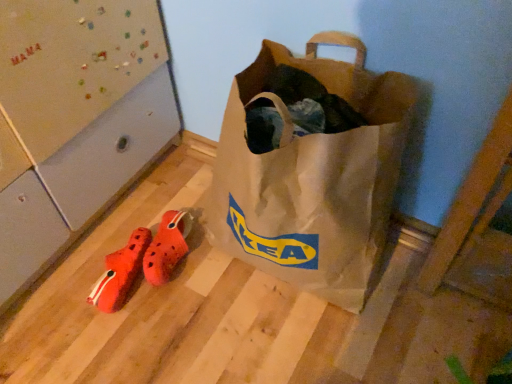
Locate an element on the screen. This screenshot has width=512, height=384. empty space that is to the right of orange rubber clogs at lower left is located at coordinates pos(231,279).